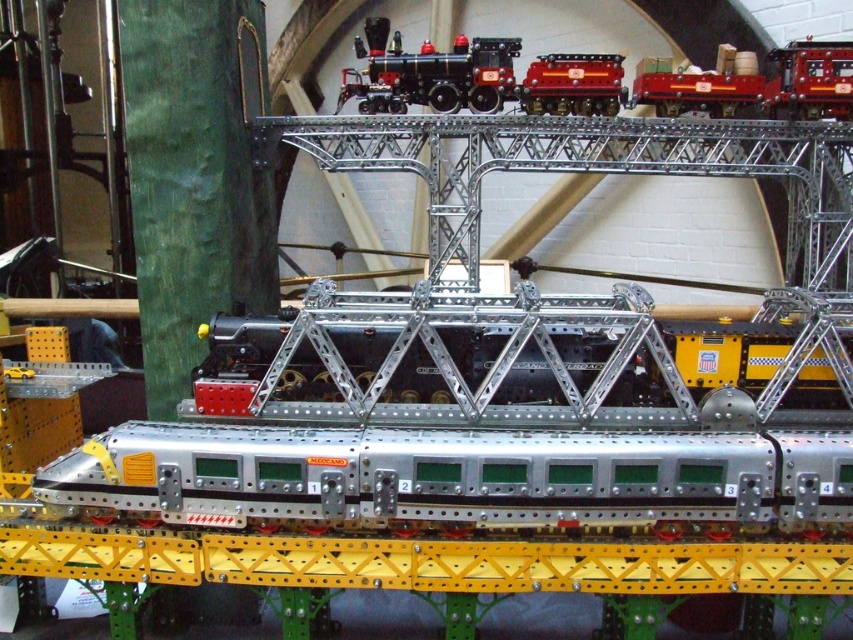
Question: Can you confirm if metallic red wagon at upper right is thinner than shiny red metal train car at center?

Choices:
 (A) no
 (B) yes

Answer: (A)

Question: Which of the following is the farthest from the observer?

Choices:
 (A) (431, 106)
 (B) (544, 60)

Answer: (A)

Question: Can you confirm if silver metallic train at center is thinner than metallic red wagon at upper right?

Choices:
 (A) yes
 (B) no

Answer: (B)

Question: Among these objects, which one is farthest from the camera?

Choices:
 (A) shiny black locomotive at upper center
 (B) metallic red wagon at upper right
 (C) shiny red metal train car at center

Answer: (B)

Question: Does shiny black locomotive at upper center appear under shiny red metal train car at center?

Choices:
 (A) yes
 (B) no

Answer: (B)

Question: Which is farther from the shiny red metal train car at center?

Choices:
 (A) shiny black locomotive at upper center
 (B) silver metallic train at center

Answer: (B)